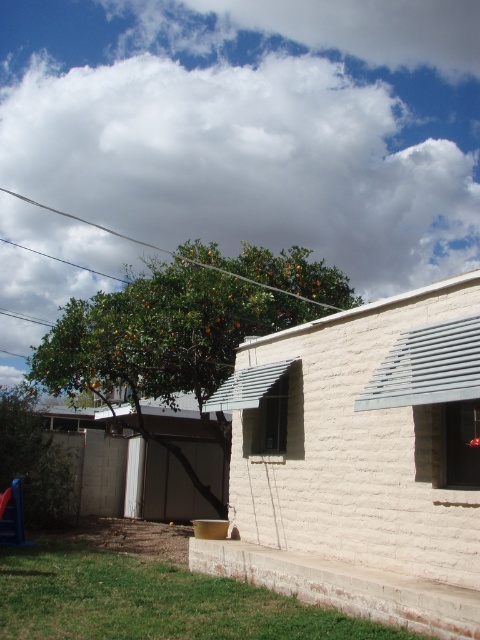
Can you confirm if green leafy tree at center is smaller than clear glass window at center?

No, green leafy tree at center is not smaller than clear glass window at center.

Does point (236, 280) come farther from viewer compared to point (259, 424)?

Yes, it is behind point (259, 424).

I want to click on green leafy tree at center, so click(181, 332).

Between white stucco shed at lower right and transparent glass window at lower right, which one has less height?

With less height is white stucco shed at lower right.

Measure the distance between white stucco shed at lower right and transparent glass window at lower right.

white stucco shed at lower right is 19.86 inches away from transparent glass window at lower right.

Measure the distance between point (288,435) and camera.

The distance of point (288,435) from camera is 9.09 meters.

Locate an element on the screen. white stucco shed at lower right is located at coordinates (360, 464).

Between white stucco shed at lower right and clear glass window at center, which one has more height?

With more height is clear glass window at center.

Who is more forward, (x=392, y=500) or (x=257, y=420)?

Point (x=392, y=500) is in front.

What are the coordinates of `white stucco shed at lower right` in the screenshot? It's located at (360, 464).